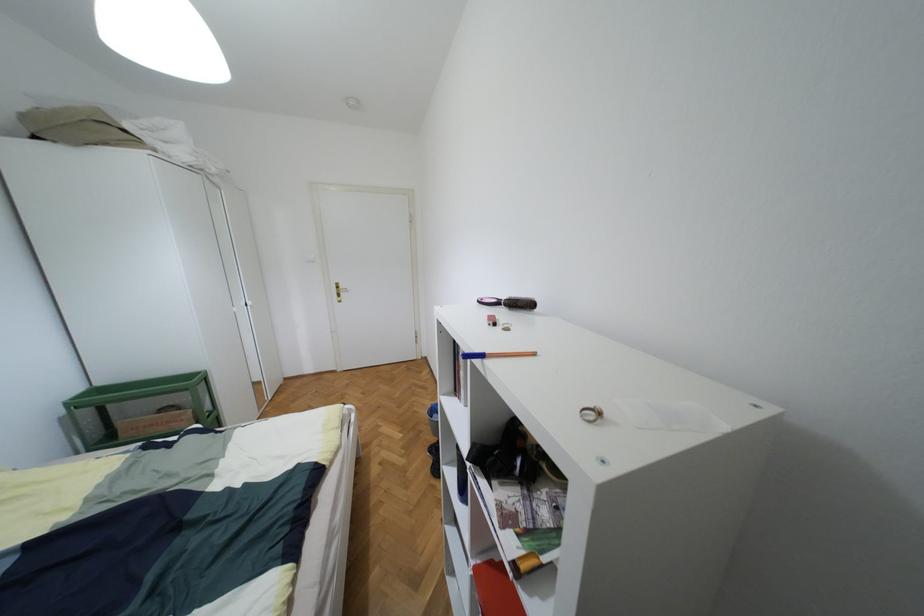
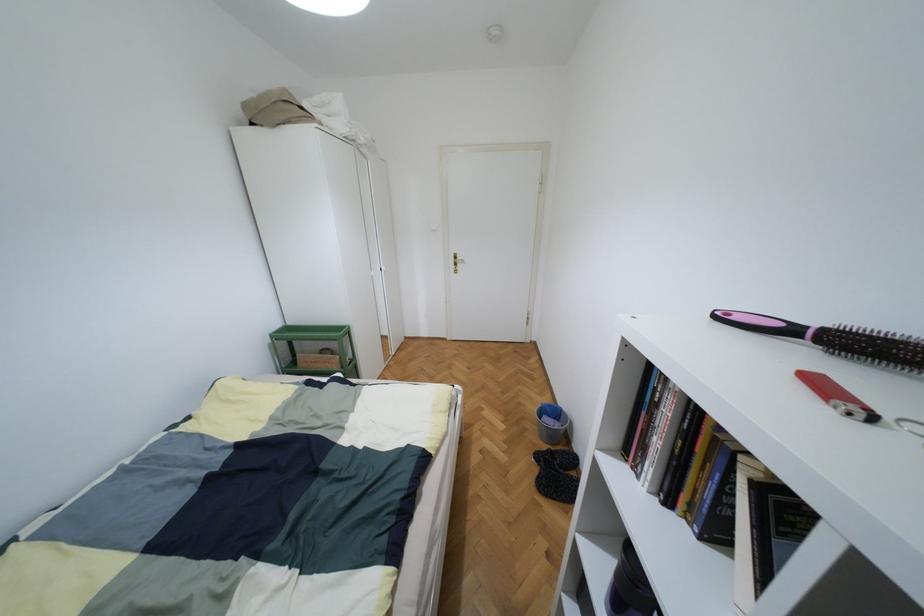
Where in the second image is the point corresponding to (341,286) from the first image?

(457, 257)